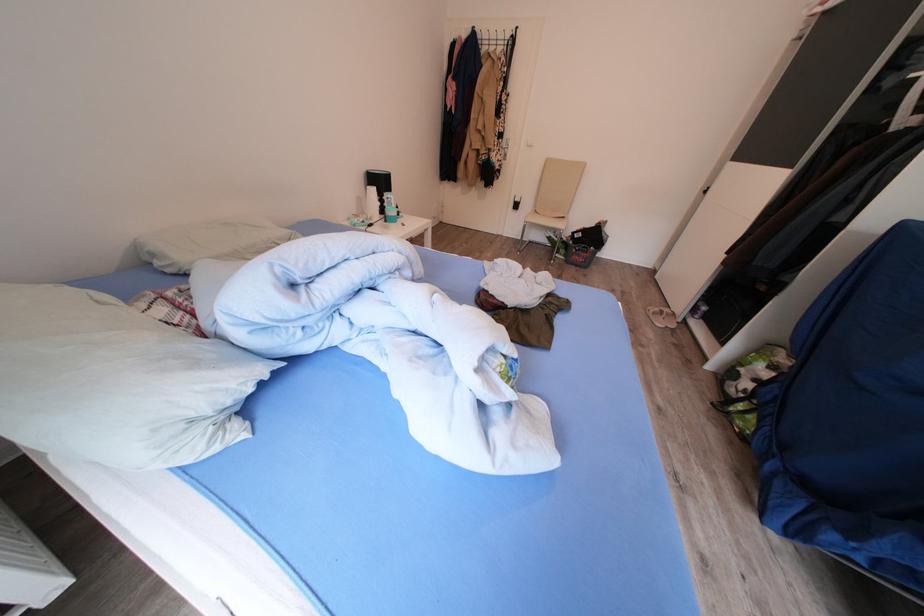
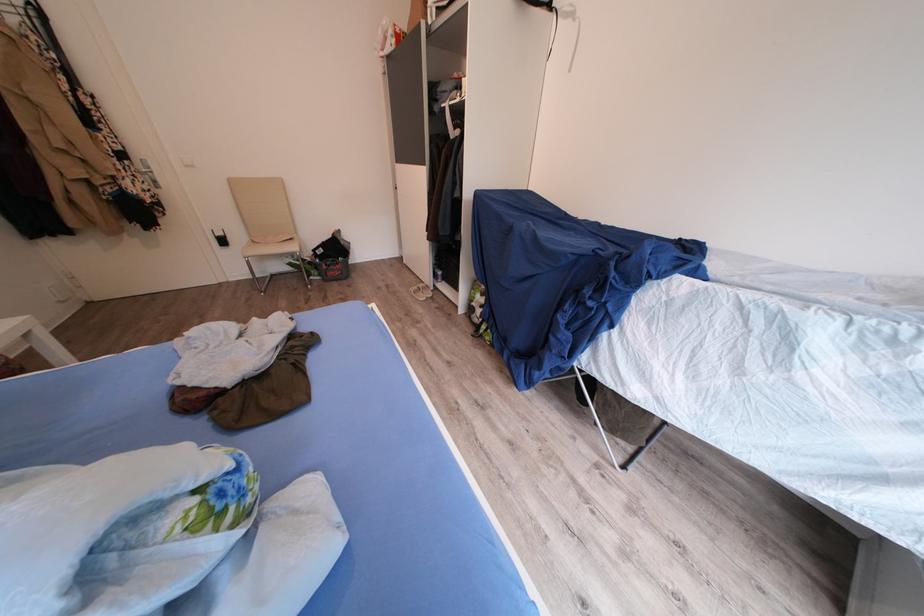
Question: How did the camera likely rotate?

Choices:
 (A) Left
 (B) Right
 (C) Up
 (D) Down

Answer: (B)